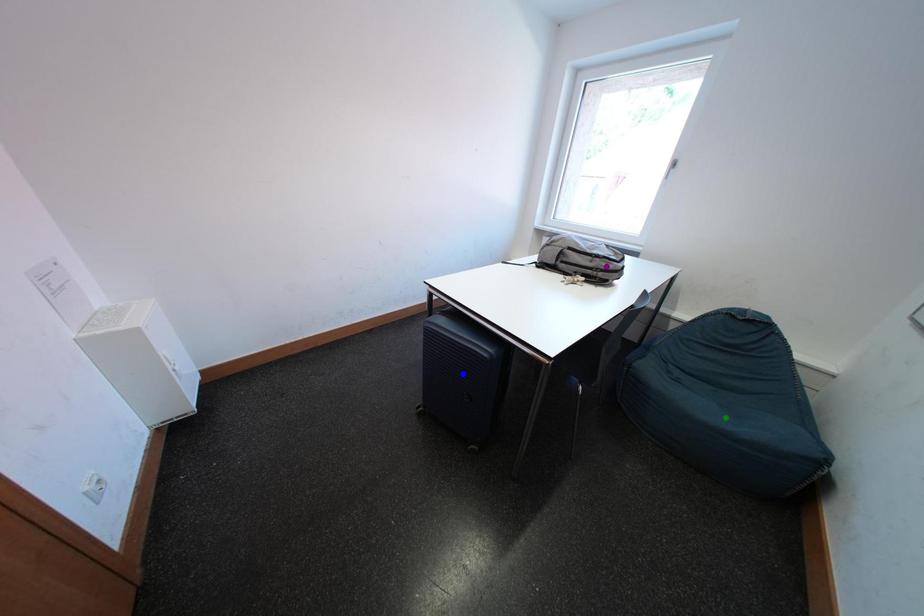
Order these from nearest to farthest:
1. blue point
2. green point
3. purple point

blue point, purple point, green point